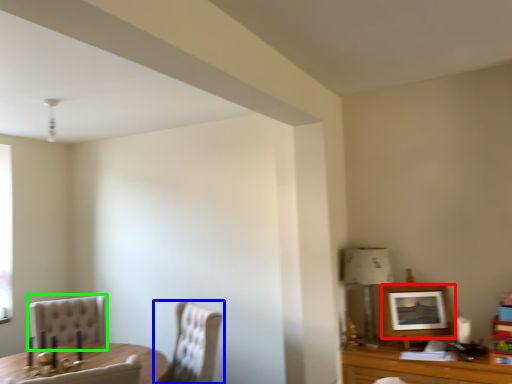
Question: Considering the real-world distances, which object is closest to picture frame (highlighted by a red box)? chair (highlighted by a blue box) or chair (highlighted by a green box).

Choices:
 (A) chair
 (B) chair

Answer: (A)